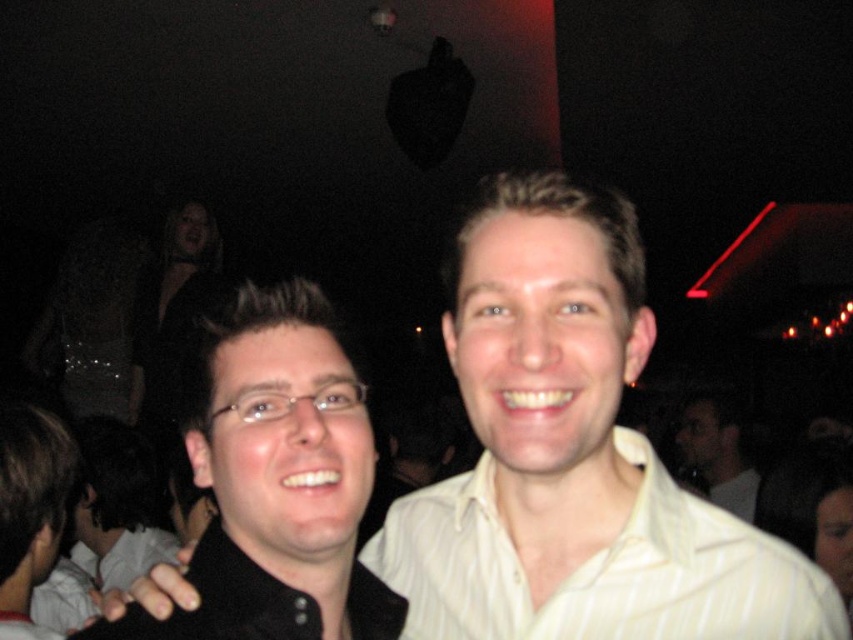
Which of these two, white striped dress shirt at center or black glossy hair at left, stands shorter?

white striped dress shirt at center is shorter.

Find the location of a particular element. The height and width of the screenshot is (640, 853). white striped dress shirt at center is located at coordinates (599, 570).

Identify the location of white striped dress shirt at center. The height and width of the screenshot is (640, 853). click(599, 570).

The height and width of the screenshot is (640, 853). I want to click on white striped dress shirt at center, so pyautogui.click(x=599, y=570).

Which is more to the left, matte black shirt at center or white striped dress shirt at center?

From the viewer's perspective, matte black shirt at center appears more on the left side.

How far apart are matte black shirt at center and white striped dress shirt at center?

matte black shirt at center is 6.70 inches from white striped dress shirt at center.

Who is more distant from viewer, (316,426) or (515,621)?

The point (515,621) is behind.

The image size is (853, 640). Find the location of `matte black shirt at center`. matte black shirt at center is located at coordinates (276, 480).

Who is lower down, matte black shirt at center or light beige shirt at center?

light beige shirt at center is lower down.

Does point (277, 440) come behind point (750, 464)?

No.

Is point (254, 298) closer to viewer compared to point (737, 470)?

Yes, point (254, 298) is in front of point (737, 470).

Identify the location of matte black shirt at center. This screenshot has height=640, width=853. (276, 480).